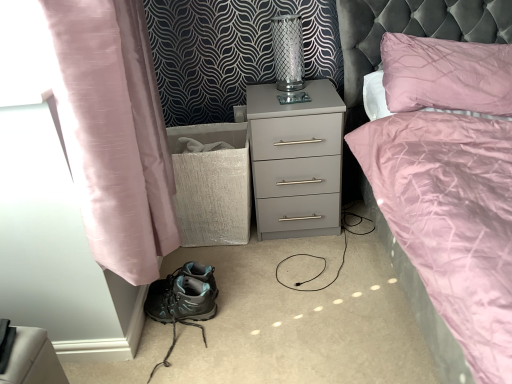
The image size is (512, 384). What are the coordinates of `vacant area that lies to the right of teal fabric hiking boots at lower left` in the screenshot? It's located at (233, 294).